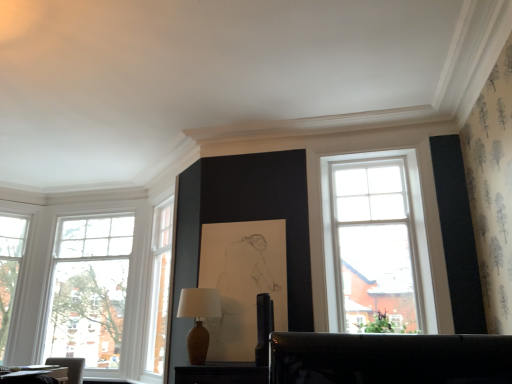
What is the approximate width of wooden table at lower left?

It is 37.59 centimeters.

Locate an element on the screen. clear glass window at left, placed as the second window when sorted from left to right is located at coordinates (82, 283).

How distant is wooden table at lower left from clear glass window at left, the first window viewed from the right?

The distance of wooden table at lower left from clear glass window at left, the first window viewed from the right, is 1.33 meters.

From a real-world perspective, is wooden table at lower left positioned under clear glass window at left, placed as the second window when sorted from left to right, based on gravity?

Yes, from a real-world perspective, wooden table at lower left is under clear glass window at left, placed as the second window when sorted from left to right.

Consider the image. Does wooden table at lower left have a lesser width compared to clear glass window at left, placed as the second window when sorted from left to right?

No.

Does point (59, 368) appear closer or farther from the camera than point (102, 298)?

Clearly, point (59, 368) is closer to the camera than point (102, 298).

From a real-world perspective, which object rests below the other?

matte brown vase at center, from a real-world perspective.

Which is more to the right, clear glass window at left, placed as the second window when sorted from left to right, or matte brown vase at center?

Positioned to the right is matte brown vase at center.

At what (x,y) coordinates should I click in order to perform the action: click on table lamp above the clear glass window at left, the first window viewed from the right (from the image's perspective). Please return your answer as a coordinate pair (x, y). Looking at the image, I should click on (198, 319).

Can you tell me how much clear glass window at left, placed as the second window when sorted from left to right, and matte brown vase at center differ in facing direction?

There is a 0.553-degree angle between the facing directions of clear glass window at left, placed as the second window when sorted from left to right, and matte brown vase at center.

This screenshot has height=384, width=512. I want to click on window located on the left of clear glass window at left, placed as the second window when sorted from left to right, so click(12, 270).

Considering the relative sizes of white glass window at left, which is the 2th window from right to left, and clear glass window at left, the first window viewed from the right, in the image provided, is white glass window at left, which is the 2th window from right to left, shorter than clear glass window at left, the first window viewed from the right,?

Correct, white glass window at left, which is the 2th window from right to left, is not as tall as clear glass window at left, the first window viewed from the right.

Is clear glass window at left, placed as the second window when sorted from left to right, a part of white glass window at left, marked as the 1th window in a left-to-right arrangement?

No.

Is point (16, 279) farther from viewer compared to point (10, 223)?

Yes.

Between wooden table at lower left and matte brown vase at center, which one appears on the left side from the viewer's perspective?

Positioned to the left is wooden table at lower left.

In the image, is wooden table at lower left positioned in front of or behind matte brown vase at center?

In the image, wooden table at lower left appears in front of matte brown vase at center.

Is wooden table at lower left oriented away from matte brown vase at center?

No, wooden table at lower left is not facing the opposite direction of matte brown vase at center.

Between matte brown vase at center and wooden table at lower left, which one is positioned behind?

matte brown vase at center is behind.

Considering the relative sizes of matte brown vase at center and wooden table at lower left in the image provided, is matte brown vase at center smaller than wooden table at lower left?

Actually, matte brown vase at center might be larger than wooden table at lower left.

From the image's perspective, relative to wooden table at lower left, is matte brown vase at center above or below?

Based on their image positions, matte brown vase at center is located above wooden table at lower left.

In terms of width, does matte brown vase at center look wider or thinner when compared to wooden table at lower left?

Clearly, matte brown vase at center has less width compared to wooden table at lower left.

Does wooden table at lower left come in front of white glass window at left, which is the 2th window from right to left?

Result: Yes, the depth of wooden table at lower left is less than that of white glass window at left, which is the 2th window from right to left.

From the image's perspective, is wooden table at lower left on top of white glass window at left, marked as the 1th window in a left-to-right arrangement?

No.

The height and width of the screenshot is (384, 512). What are the coordinates of `table below the white glass window at left, marked as the 1th window in a left-to-right arrangement (from the image's perspective)` in the screenshot? It's located at (36, 376).

Considering the relative positions of matte brown vase at center and white glass window at left, which is the 2th window from right to left, in the image provided, is matte brown vase at center in front of white glass window at left, which is the 2th window from right to left,?

Yes, matte brown vase at center is in front of white glass window at left, which is the 2th window from right to left.

Are matte brown vase at center and white glass window at left, which is the 2th window from right to left, located far from each other?

Yes, matte brown vase at center and white glass window at left, which is the 2th window from right to left, are located far from each other.

Is matte brown vase at center thinner than white glass window at left, marked as the 1th window in a left-to-right arrangement?

Yes.

From a real-world perspective, who is located lower, matte brown vase at center or white glass window at left, which is the 2th window from right to left?

matte brown vase at center, from a real-world perspective.

Find the location of a particular element. The image size is (512, 384). the 1st window behind the wooden table at lower left, starting your count from the anchor is located at coordinates (82, 283).

Locate an element on the screen. The width and height of the screenshot is (512, 384). table lamp below the clear glass window at left, the first window viewed from the right (from a real-world perspective) is located at coordinates (198, 319).

Which object lies further to the anchor point white glass window at left, marked as the 1th window in a left-to-right arrangement, wooden table at lower left or clear glass window at left, placed as the second window when sorted from left to right?

The object further to white glass window at left, marked as the 1th window in a left-to-right arrangement, is wooden table at lower left.

Which object lies nearer to the anchor point white glass window at left, marked as the 1th window in a left-to-right arrangement, wooden table at lower left or matte brown vase at center?

wooden table at lower left is positioned closer to the anchor white glass window at left, marked as the 1th window in a left-to-right arrangement.

Which object lies further to the anchor point wooden table at lower left, clear glass window at left, the first window viewed from the right, or white glass window at left, marked as the 1th window in a left-to-right arrangement?

white glass window at left, marked as the 1th window in a left-to-right arrangement.

From the image, which object appears to be nearer to clear glass window at left, placed as the second window when sorted from left to right, matte brown vase at center or wooden table at lower left?

wooden table at lower left lies closer to clear glass window at left, placed as the second window when sorted from left to right, than the other object.

Looking at the image, which one is located further to wooden table at lower left, white glass window at left, marked as the 1th window in a left-to-right arrangement, or matte brown vase at center?

The object further to wooden table at lower left is matte brown vase at center.

From the image, which object appears to be farther from white glass window at left, which is the 2th window from right to left, matte brown vase at center or wooden table at lower left?

The object further to white glass window at left, which is the 2th window from right to left, is matte brown vase at center.

Looking at this image, considering their positions, is matte brown vase at center positioned further to wooden table at lower left than clear glass window at left, placed as the second window when sorted from left to right?

matte brown vase at center.

Considering their positions, is white glass window at left, marked as the 1th window in a left-to-right arrangement, positioned closer to matte brown vase at center than clear glass window at left, placed as the second window when sorted from left to right?

The object closer to matte brown vase at center is clear glass window at left, placed as the second window when sorted from left to right.

Identify the location of window between white glass window at left, marked as the 1th window in a left-to-right arrangement, and matte brown vase at center from left to right. The width and height of the screenshot is (512, 384). point(82,283).

Where is `window positioned between wooden table at lower left and white glass window at left, marked as the 1th window in a left-to-right arrangement, from near to far`? This screenshot has height=384, width=512. window positioned between wooden table at lower left and white glass window at left, marked as the 1th window in a left-to-right arrangement, from near to far is located at coordinates (82, 283).

Identify the location of table between white glass window at left, which is the 2th window from right to left, and matte brown vase at center from left to right. (36, 376).

This screenshot has width=512, height=384. I want to click on table lamp between wooden table at lower left and clear glass window at left, the first window viewed from the right, along the z-axis, so pyautogui.click(x=198, y=319).